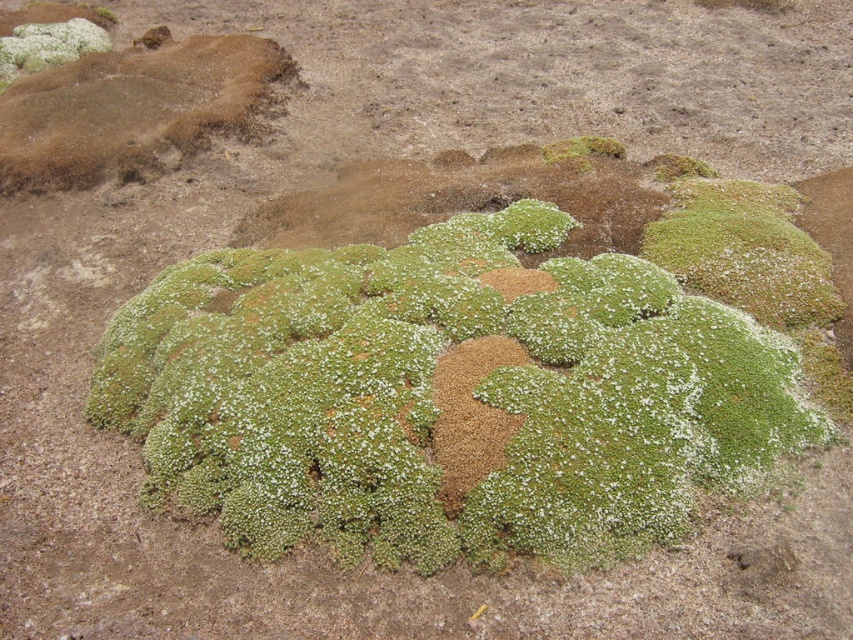
Question: From the image, what is the correct spatial relationship of green mossy mound at upper left in relation to green fuzzy moss at upper center?

Choices:
 (A) left
 (B) right

Answer: (A)

Question: From the image, what is the correct spatial relationship of green mossy mound at center in relation to green fuzzy plant at upper left?

Choices:
 (A) below
 (B) above

Answer: (A)

Question: Which point is closer to the camera taking this photo?

Choices:
 (A) (294, 214)
 (B) (589, 152)
 (C) (88, 26)

Answer: (A)

Question: Based on their relative distances, which object is farther from the green mossy mound at upper left?

Choices:
 (A) green mossy mound at center
 (B) green fuzzy plant at upper left

Answer: (A)

Question: Can you confirm if green mossy mound at center is positioned below green fuzzy moss at upper center?

Choices:
 (A) no
 (B) yes

Answer: (B)

Question: Which of the following is the farthest from the observer?

Choices:
 (A) (564, 164)
 (B) (56, 58)
 (C) (467, 180)

Answer: (B)